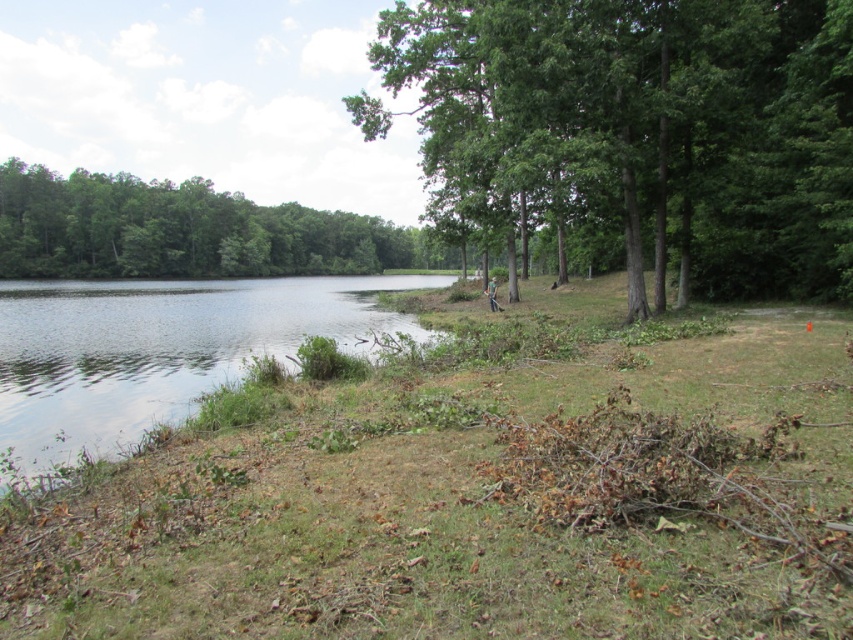
Which is above, green leafy tree at center or clear water at lake left?

green leafy tree at center is above.

Is green leafy tree at center to the left of clear water at lake left from the viewer's perspective?

Incorrect, green leafy tree at center is not on the left side of clear water at lake left.

Locate an element on the screen. The image size is (853, 640). green leafy tree at center is located at coordinates (637, 132).

Identify the location of green leafy tree at center. Image resolution: width=853 pixels, height=640 pixels. (637, 132).

Is green leafy tree at center below green leafy tree at left?

Actually, green leafy tree at center is above green leafy tree at left.

Is green leafy tree at center taller than green leafy tree at left?

Yes, green leafy tree at center is taller than green leafy tree at left.

You are a GUI agent. You are given a task and a screenshot of the screen. Output one action in this format:
    pyautogui.click(x=<x>, y=<y>)
    Task: Click on the green leafy tree at center
    This screenshot has width=853, height=640.
    Given the screenshot: What is the action you would take?
    pyautogui.click(x=637, y=132)

Does point (13, 364) come farther from viewer compared to point (137, 236)?

No, (13, 364) is closer to viewer.

What do you see at coordinates (160, 349) in the screenshot? I see `clear water at lake left` at bounding box center [160, 349].

You are a GUI agent. You are given a task and a screenshot of the screen. Output one action in this format:
    pyautogui.click(x=<x>, y=<y>)
    Task: Click on the clear water at lake left
    
    Given the screenshot: What is the action you would take?
    pyautogui.click(x=160, y=349)